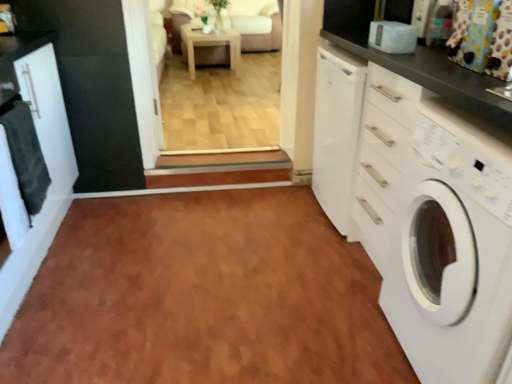
The width and height of the screenshot is (512, 384). Identify the location of free space above brown laminate floor at center (from a real-world perspective). tap(178, 269).